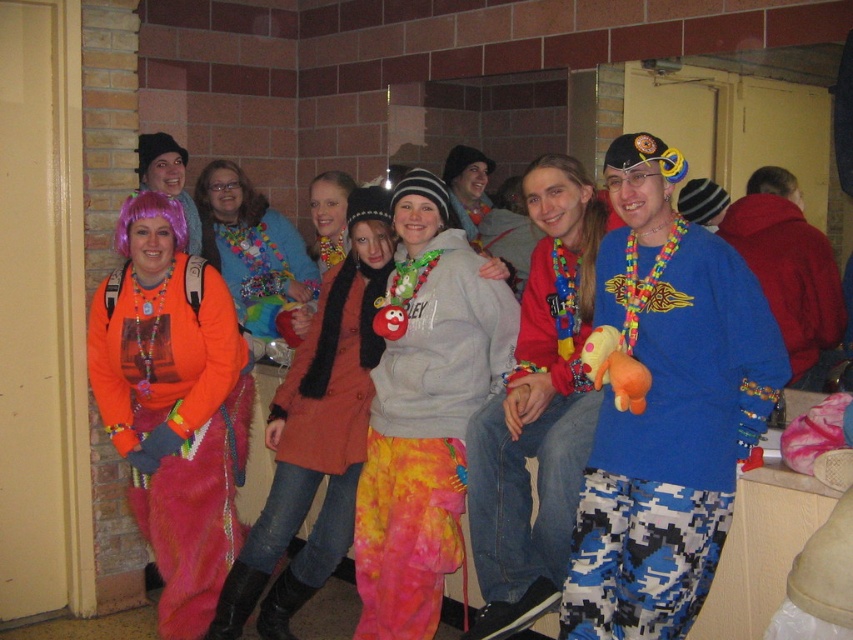
Does camouflage pants at center have a greater height compared to shiny purple wig at center?

Correct, camouflage pants at center is much taller as shiny purple wig at center.

Looking at this image, measure the distance from camouflage pants at center to shiny purple wig at center.

6.46 feet

Does point (573, 480) come behind point (194, 221)?

No, it is not.

The height and width of the screenshot is (640, 853). I want to click on camouflage pants at center, so click(x=537, y=426).

In the scene shown: Can you confirm if blue digital camouflage pants at right is positioned to the right of orange fleece jacket at center?

Correct, you'll find blue digital camouflage pants at right to the right of orange fleece jacket at center.

Can you confirm if blue digital camouflage pants at right is bigger than orange fleece jacket at center?

No, blue digital camouflage pants at right is not bigger than orange fleece jacket at center.

Measure the distance between blue digital camouflage pants at right and camera.

The distance of blue digital camouflage pants at right from camera is 7.89 feet.

Where is `blue digital camouflage pants at right`? blue digital camouflage pants at right is located at coordinates (669, 433).

Is red fuzzy coat at center further to camera compared to shiny purple wig at center?

No, red fuzzy coat at center is closer to the viewer.

From the picture: Which is above, red fuzzy coat at center or shiny purple wig at center?

shiny purple wig at center

Is point (801, 220) more distant than point (160, 131)?

No, it is in front of (160, 131).

I want to click on red fuzzy coat at center, so click(x=785, y=266).